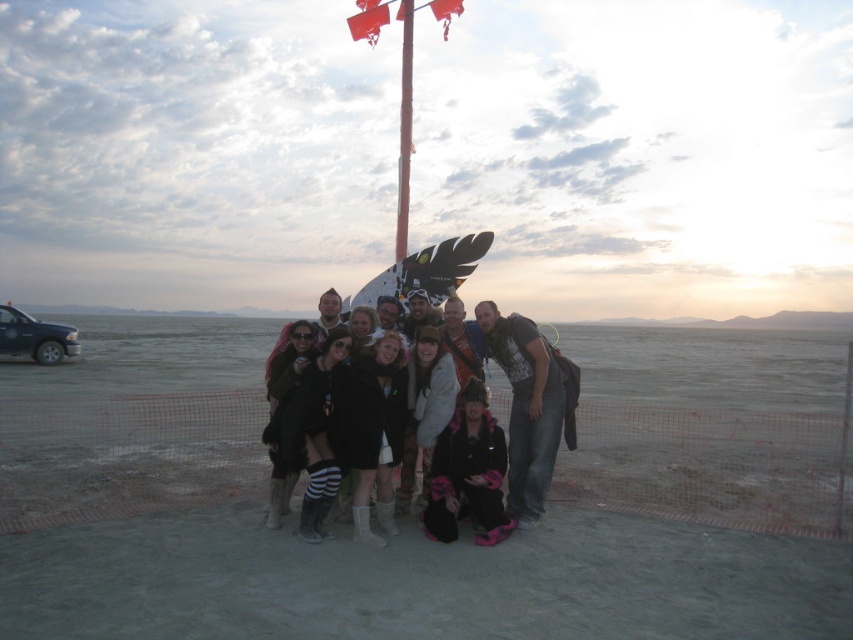
You are a photographer setting up for a group photo. You notice a white glossy flag pole at center and a red fabric flag at upper center in the scene. Which object would likely block the sunlight more when positioned between the camera and the group?

The white glossy flag pole at center is larger in size compared to the red fabric flag at upper center, so it would likely block more sunlight when positioned between the camera and the group.

You are standing at the camera position and want to place a small flag exactly halfway between point (473, 328) and point (398, 198). Which direction should you move from the midpoint to ensure the flag is closer to the foreground group of people?

Since point (473, 328) is in front of point (398, 198), the midpoint between them would be closer to the foreground group. Therefore, you don